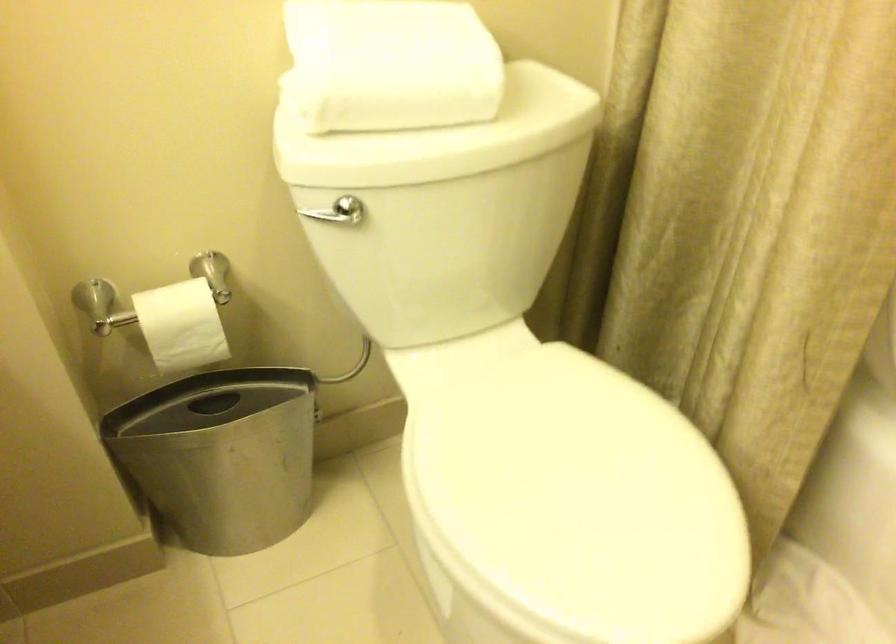
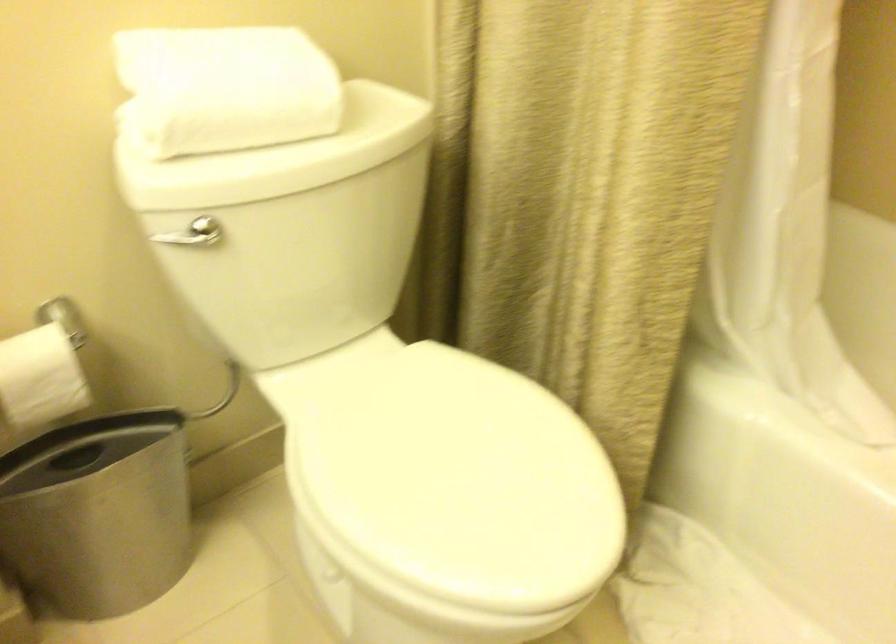
Where in the second image is the point corresponding to the point at 222,462 from the first image?

(98, 514)